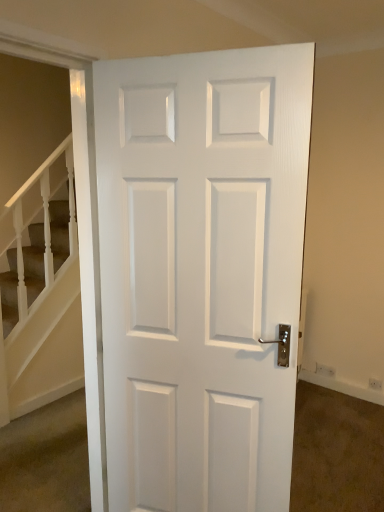
Question: Do you think white textured stairs at left is within white glossy door at center, or outside of it?

Choices:
 (A) inside
 (B) outside

Answer: (B)

Question: Is white textured stairs at left to the left or to the right of white glossy door at center in the image?

Choices:
 (A) right
 (B) left

Answer: (B)

Question: Does point (16, 205) appear closer or farther from the camera than point (210, 204)?

Choices:
 (A) closer
 (B) farther

Answer: (B)

Question: In terms of size, does white glossy door at center appear bigger or smaller than white textured stairs at left?

Choices:
 (A) big
 (B) small

Answer: (A)

Question: Is point (x=240, y=146) positioned closer to the camera than point (x=67, y=374)?

Choices:
 (A) farther
 (B) closer

Answer: (B)

Question: In the image, is white glossy door at center on the left side or the right side of white textured stairs at left?

Choices:
 (A) right
 (B) left

Answer: (A)

Question: Is white glossy door at center situated inside white textured stairs at left or outside?

Choices:
 (A) inside
 (B) outside

Answer: (B)